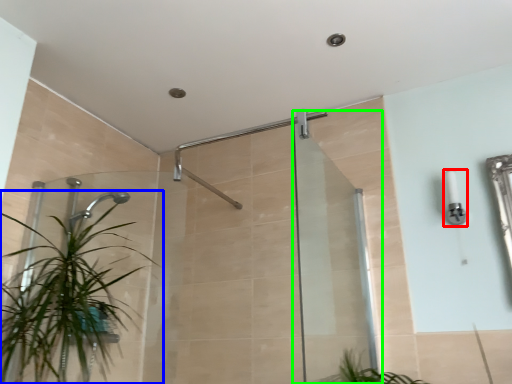
Question: Which object is the closest to the light fixture (highlighted by a red box)? Choose among these: houseplant (highlighted by a blue box) or screen door (highlighted by a green box).

Choices:
 (A) houseplant
 (B) screen door

Answer: (B)